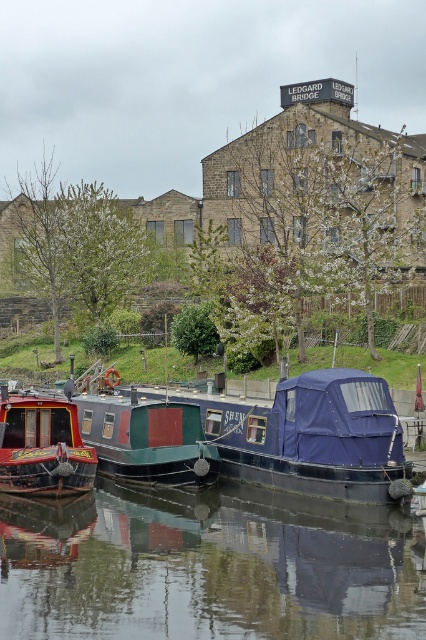
Can you confirm if blue tarpaulin boat at center is positioned below green matte boat at center?

No, blue tarpaulin boat at center is not below green matte boat at center.

Which is above, blue tarpaulin boat at center or green matte boat at center?

blue tarpaulin boat at center

This screenshot has height=640, width=426. What do you see at coordinates (313, 436) in the screenshot? I see `blue tarpaulin boat at center` at bounding box center [313, 436].

You are a GUI agent. You are given a task and a screenshot of the screen. Output one action in this format:
    pyautogui.click(x=<x>, y=<y>)
    Task: Click on the blue tarpaulin boat at center
    This screenshot has width=426, height=640.
    Given the screenshot: What is the action you would take?
    pyautogui.click(x=313, y=436)

Between smooth reflective water at center and shiny red boat at left, which one is positioned lower?

smooth reflective water at center

Can you confirm if smooth reflective water at center is taller than shiny red boat at left?

Indeed, smooth reflective water at center has a greater height compared to shiny red boat at left.

Between point (204, 512) and point (92, 452), which one is positioned in front?

Point (204, 512) is in front.

This screenshot has height=640, width=426. I want to click on smooth reflective water at center, so click(x=207, y=566).

Between smooth reflective water at center and blue tarpaulin boat at center, which one is positioned higher?

blue tarpaulin boat at center is higher up.

Between point (253, 584) and point (313, 424), which one is positioned behind?

The point (313, 424) is more distant.

Is point (34, 627) positioned after point (241, 474)?

No, (34, 627) is closer to viewer.

The height and width of the screenshot is (640, 426). I want to click on smooth reflective water at center, so click(207, 566).